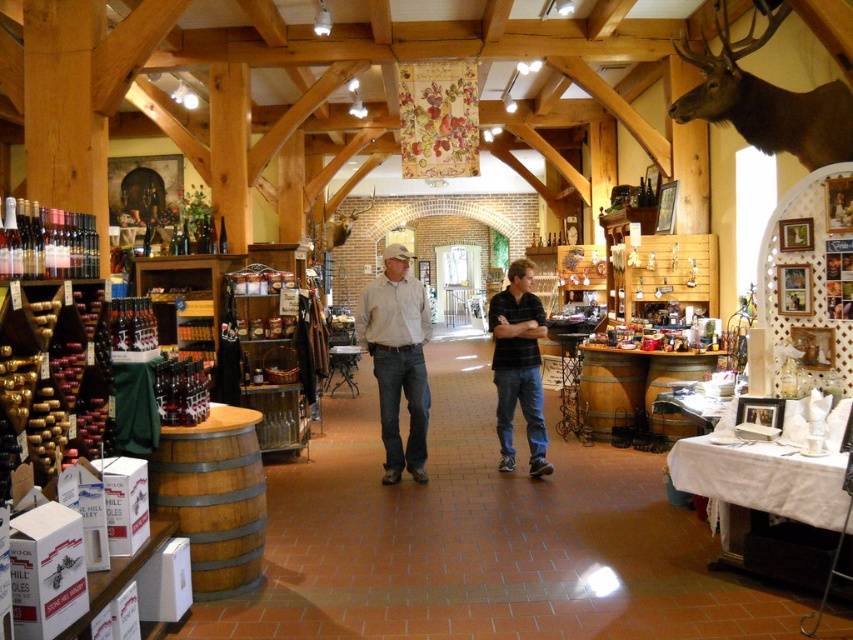
You are a customer in the store and want to place a small gift box on the brown wooden barrel at lower left. However, you are concerned about whether the barrel can support the box. Considering the size of the black cotton shirt at center, which is placed on the barrel, do you think the barrel is large enough to hold the gift box?

The brown wooden barrel at lower left is smaller than the black cotton shirt at center. Since the shirt is already on the barrel, the barrel might not have enough space to accommodate the gift box as well.

You are a customer in the store and want to pick up the light brown denim jeans at center. The brown wooden barrel at lower left is in your way. Can you walk around it?

The brown wooden barrel at lower left is 6.84 feet from the light brown denim jeans at center. Since the distance between them is sufficient, you can easily walk around the brown wooden barrel at lower left to reach the light brown denim jeans at center.

You are a customer in a store and want to pick up the light brown denim jeans at center and the black cotton shirt at center. The store has a rule that items must be at least 1 meter apart to qualify for a discount. Do these items qualify?

The distance between the light brown denim jeans at center and the black cotton shirt at center is 83.62 centimeters, which is less than 1 meter. Therefore, these items do not qualify for the discount.